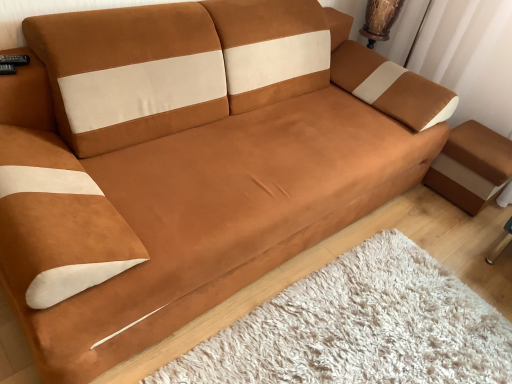
The image size is (512, 384). Find the location of `brown suede ottoman at right`. brown suede ottoman at right is located at coordinates (471, 166).

What is the approximate width of brown suede ottoman at right?

It is 13.87 inches.

Describe the element at coordinates (471, 166) in the screenshot. I see `brown suede ottoman at right` at that location.

Where is `brown suede ottoman at right`? This screenshot has width=512, height=384. brown suede ottoman at right is located at coordinates [471, 166].